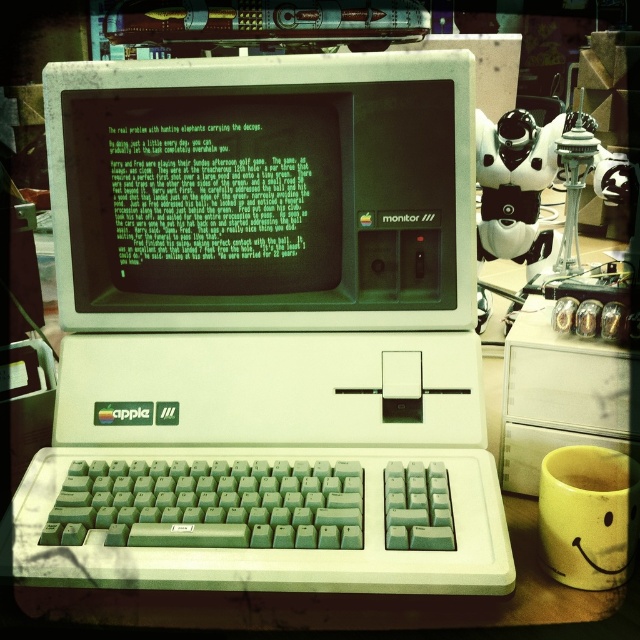
You are looking at the vintage Apple II computer and two points in the scene. The first point is at coordinates point (305,256) and the second is at point (600,449). Which point is closer to you?

Point (305,256) is closer to you because it is further to the camera than point (600,449).

You are setting up a desk for a retro computing enthusiast. You have two monitors, the white plastic apple iii monitor at center and the matte white monitor at center. According to the scene, which monitor should be placed to the right to match the existing setup?

The white plastic apple iii monitor at center should be placed to the right of the matte white monitor at center since it is positioned on the right side of it in the scene.

Based on the photo, you are setting up a desk for a retro computing enthusiast. The enthusiast wants to place the white plastic apple iii monitor at center above the matte white monitor at center. Is this possible based on the current arrangement?

The white plastic apple iii monitor at center is currently below the matte white monitor at center, so it cannot be placed above it in the current setup.